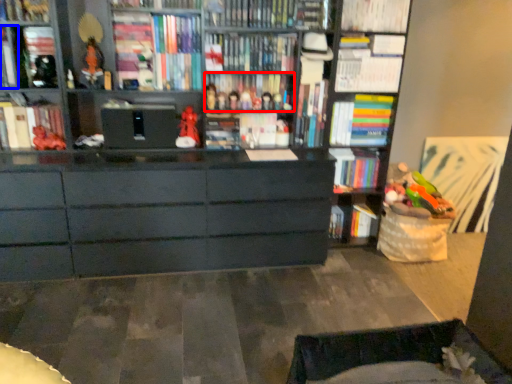
Question: Which of the following is the closest to the observer, book (highlighted by a red box) or book (highlighted by a blue box)?

Choices:
 (A) book
 (B) book

Answer: (B)